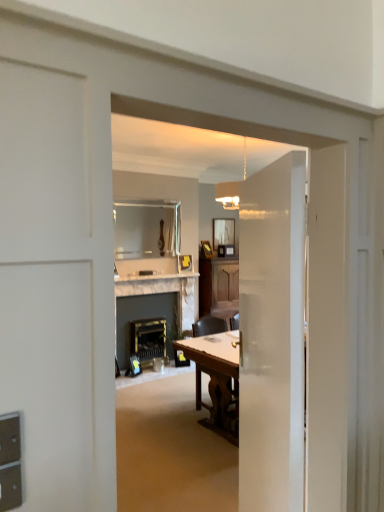
Question: Does matte glass mirror at upper center, acting as the 2th mirror starting from the left, appear on the left side of white marble fireplace at center?

Choices:
 (A) no
 (B) yes

Answer: (A)

Question: From the image's perspective, is matte glass mirror at upper center, which is counted as the 1th mirror, starting from the right, on top of white marble fireplace at center?

Choices:
 (A) yes
 (B) no

Answer: (A)

Question: Is matte glass mirror at upper center, acting as the 2th mirror starting from the left, turned away from white marble fireplace at center?

Choices:
 (A) yes
 (B) no

Answer: (B)

Question: Does matte glass mirror at upper center, acting as the 2th mirror starting from the left, lie in front of white marble fireplace at center?

Choices:
 (A) no
 (B) yes

Answer: (A)

Question: Is matte glass mirror at upper center, which is counted as the 1th mirror, starting from the right, bigger than white marble fireplace at center?

Choices:
 (A) no
 (B) yes

Answer: (A)

Question: Is wooden table at center inside the boundaries of metallic brass fireplace at center, or outside?

Choices:
 (A) inside
 (B) outside

Answer: (B)

Question: In terms of width, does wooden table at center look wider or thinner when compared to metallic brass fireplace at center?

Choices:
 (A) thin
 (B) wide

Answer: (B)

Question: From the image's perspective, is wooden table at center positioned above or below metallic brass fireplace at center?

Choices:
 (A) above
 (B) below

Answer: (B)

Question: Considering the positions of wooden table at center and metallic brass fireplace at center in the image, is wooden table at center taller or shorter than metallic brass fireplace at center?

Choices:
 (A) short
 (B) tall

Answer: (B)

Question: From a real-world perspective, is white marble fireplace at center positioned above or below matte glass mirror at upper center, which is counted as the 1th mirror, starting from the right?

Choices:
 (A) above
 (B) below

Answer: (B)

Question: Based on their sizes in the image, would you say white marble fireplace at center is bigger or smaller than matte glass mirror at upper center, the 2th mirror when ordered from front to back?

Choices:
 (A) big
 (B) small

Answer: (A)

Question: Which is correct: white marble fireplace at center is inside matte glass mirror at upper center, acting as the 2th mirror starting from the left, or outside of it?

Choices:
 (A) outside
 (B) inside

Answer: (A)

Question: Considering the positions of white marble fireplace at center and matte glass mirror at upper center, the 2th mirror when ordered from front to back, in the image, is white marble fireplace at center taller or shorter than matte glass mirror at upper center, the 2th mirror when ordered from front to back,?

Choices:
 (A) short
 (B) tall

Answer: (B)

Question: Considering the positions of metallic brass fireplace at center and wooden table at center in the image, is metallic brass fireplace at center taller or shorter than wooden table at center?

Choices:
 (A) short
 (B) tall

Answer: (A)

Question: Considering their positions, is metallic brass fireplace at center located in front of or behind wooden table at center?

Choices:
 (A) behind
 (B) front

Answer: (A)